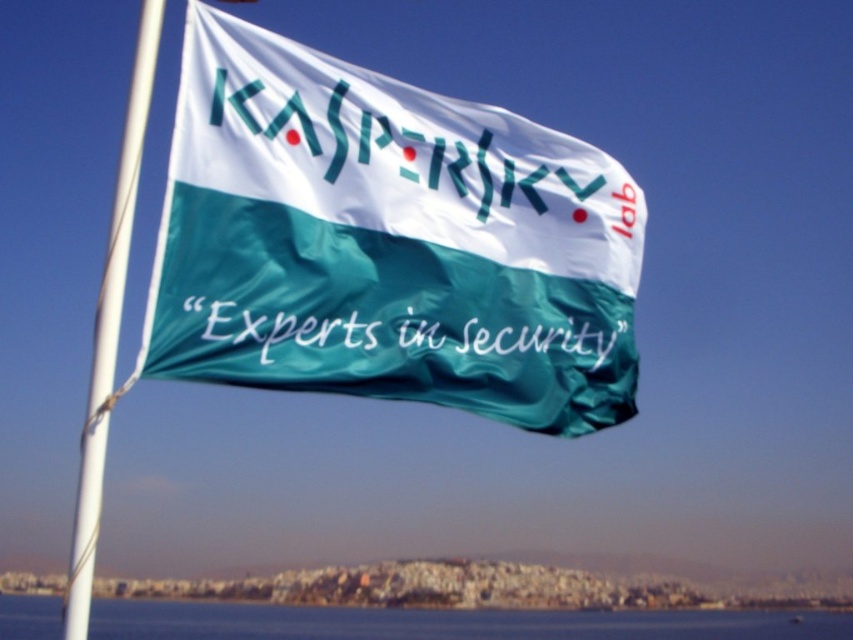
Looking at this image, you are looking at a flagpole with two flags. The silky green flag at center and the green fabric flag at center are both present. Which flag is closer to you?

The silky green flag at center is closer to the viewer than the green fabric flag at center.

You are standing in front of the flagpole with the waving flag that has a white upper half and teal lower half. There is a point marked at coordinates point (297, 316). Can you reach this point with a 14 meter long pole?

The point (297, 316) is 13.71 meters away from the camera, so yes, a 14 meter long pole can reach it.